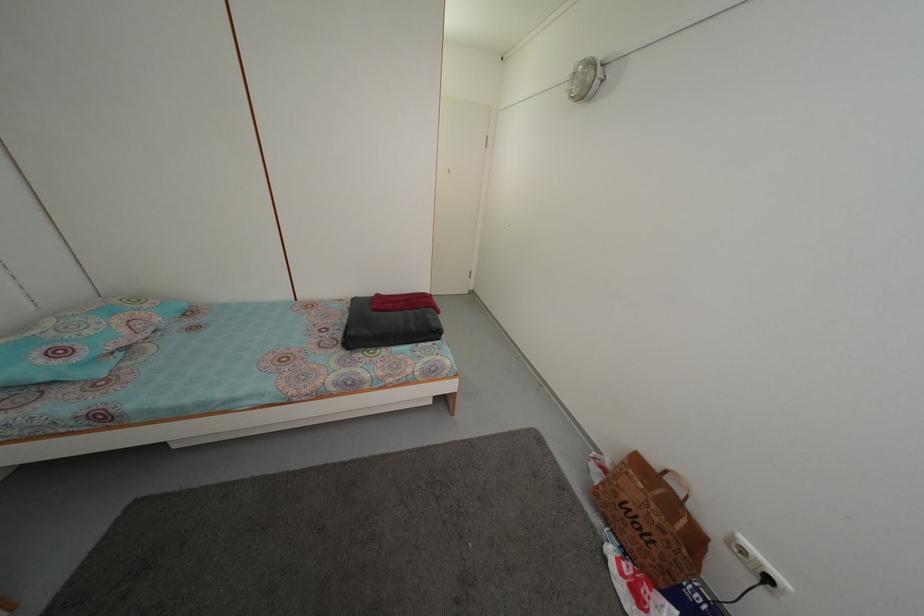
Describe the element at coordinates (737, 546) in the screenshot. The width and height of the screenshot is (924, 616). I see `a power outlet socket` at that location.